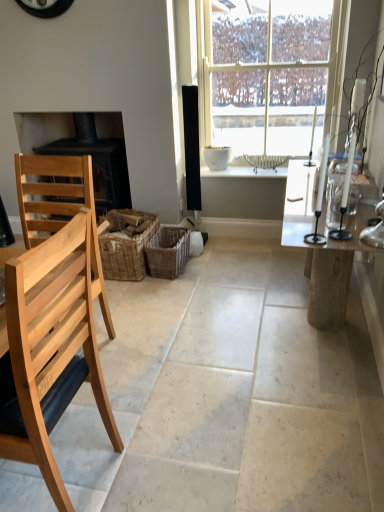
Locate an element on the screen. This screenshot has height=512, width=384. free spot to the right of natural wood chair at left, arranged as the 2th chair when viewed from the front is located at coordinates (147, 365).